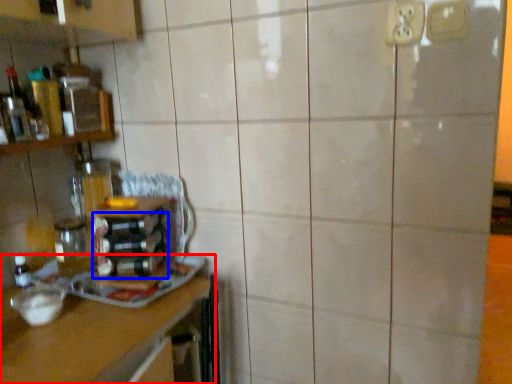
Question: Which point is further to the camera, countertop (highlighted by a red box) or bottle (highlighted by a blue box)?

Choices:
 (A) countertop
 (B) bottle

Answer: (B)